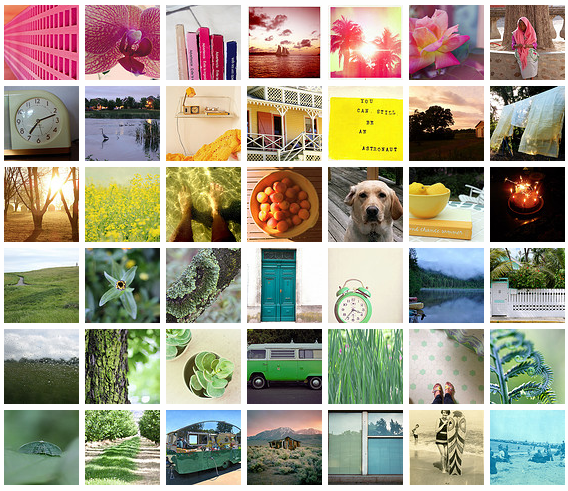
Locate an element on the screen. right row of photographs is located at coordinates (530, 446), (530, 370), (528, 285), (528, 208), (528, 138), (534, 58).